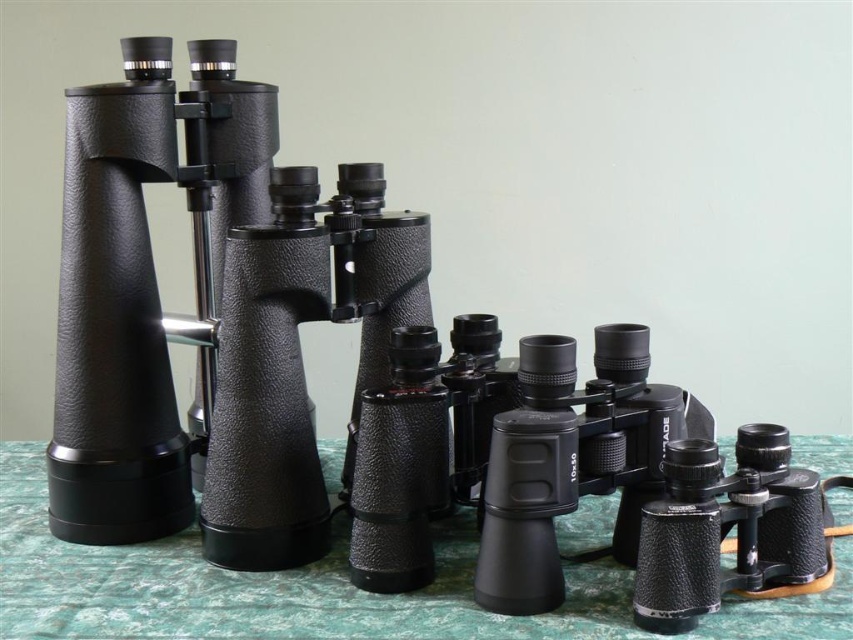
Question: Is green textured tablecloth at center to the left of matte black binoculars at center from the viewer's perspective?

Choices:
 (A) no
 (B) yes

Answer: (A)

Question: Which object appears farthest from the camera in this image?

Choices:
 (A) green textured tablecloth at center
 (B) matte black binoculars at center

Answer: (B)

Question: Considering the relative positions of green textured tablecloth at center and matte black binoculars at center in the image provided, where is green textured tablecloth at center located with respect to matte black binoculars at center?

Choices:
 (A) below
 (B) above

Answer: (A)

Question: Is the position of green textured tablecloth at center less distant than that of matte black binoculars at center?

Choices:
 (A) no
 (B) yes

Answer: (B)

Question: Among these objects, which one is nearest to the camera?

Choices:
 (A) matte black binoculars at center
 (B) green textured tablecloth at center

Answer: (B)

Question: Which object appears closest to the camera in this image?

Choices:
 (A) green textured tablecloth at center
 (B) matte black binoculars at center

Answer: (A)